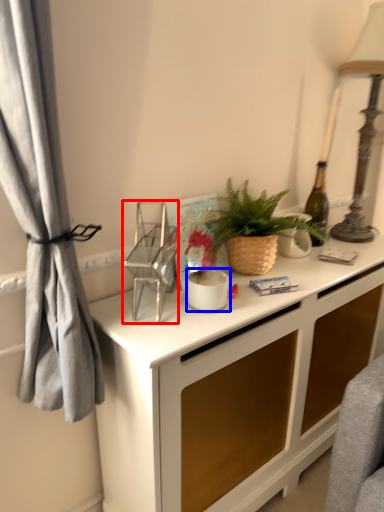
Question: Among these objects, which one is nearest to the camera, appliance (highlighted by a red box) or appliance (highlighted by a blue box)?

Choices:
 (A) appliance
 (B) appliance

Answer: (A)